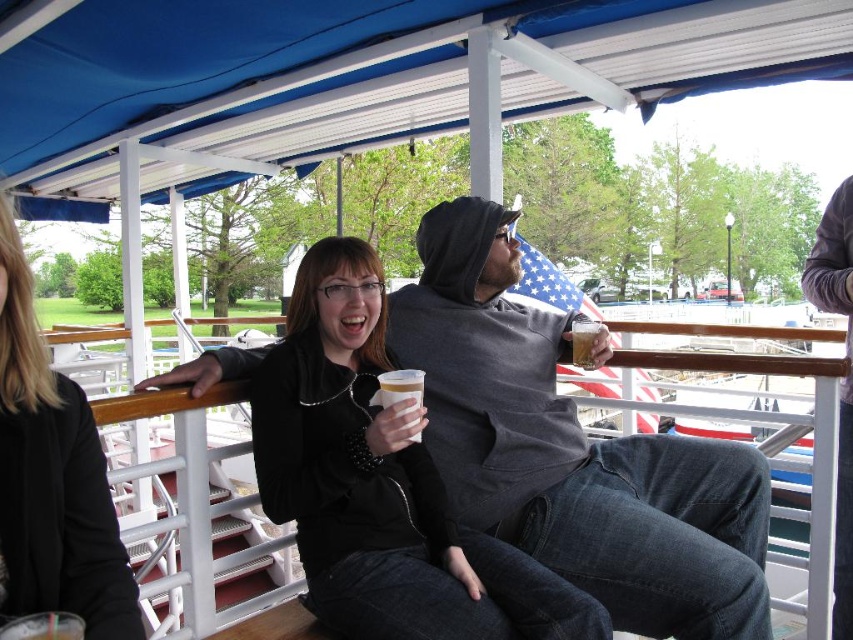
Consider the image. You are organizing a clothing donation drive and need to determine which of the two jackets can accommodate a larger donation item. Based on the scene, which jacket between the dark gray hoodie at center and the matte black jacket at center is bigger?

The dark gray hoodie at center is larger in size than the matte black jacket at center, so it can accommodate larger donation items.

You are standing on the deck and want to hand a drink to both the black matte jacket at center and the matte black jacket at center. Which one should you approach first to ensure you can reach them without moving too far from your current position?

You should approach the black matte jacket at center first because it is closer to you than the matte black jacket at center, so you can reach them without moving as far.